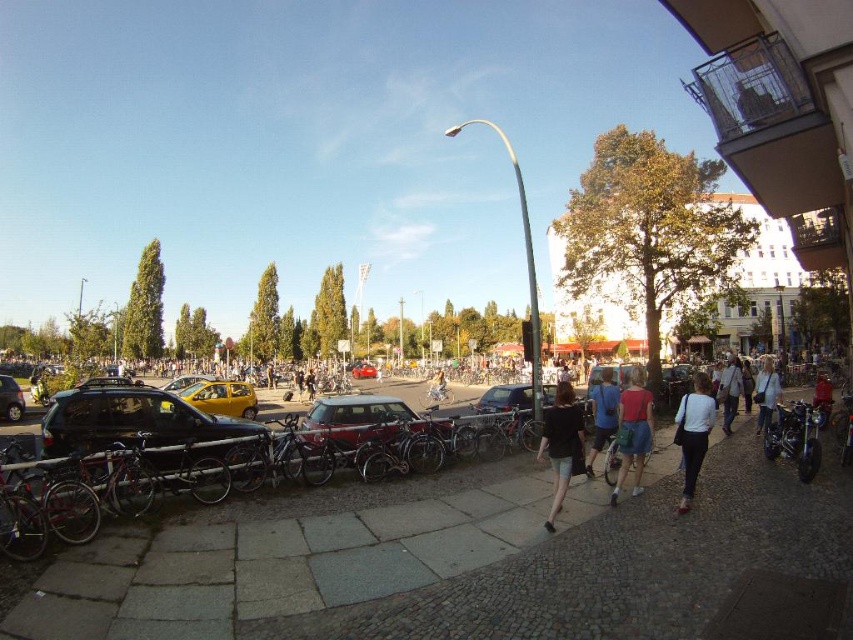
You are a delivery person who needs to place a small package on the cobblestone pavement at center or the matte pink shirt at center. Which surface is more suitable for placing the package?

The cobblestone pavement at center is bigger than the matte pink shirt at center, so the cobblestone pavement at center is more suitable for placing the small package.

You are a photographer standing at the intersection, and you want to take a photo of the matte pink shirt at center and denim shorts at center. Which one is on the right side when looking at the scene?

The matte pink shirt at center is positioned on the right side of denim shorts at center, so when looking at the scene, the matte pink shirt at center is on the right side of the denim shorts at center.

You are a photographer standing at the intersection and notice a person wearing a matte pink shirt at center and denim shorts at center. Which clothing item is positioned higher on their body?

The matte pink shirt at center is much taller as denim shorts at center, so the matte pink shirt at center is positioned higher on their body.